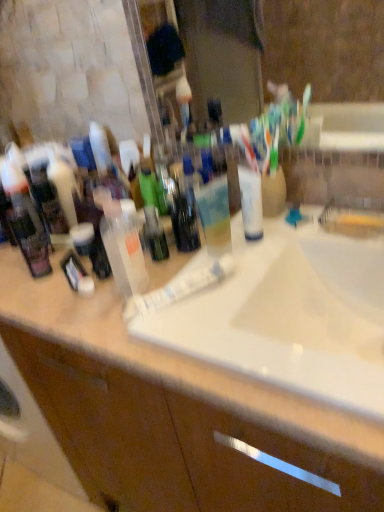
The image size is (384, 512). I want to click on vacant space in front of matte black lotion at center, arranged as the 1th toiletry when viewed from the left, so 36,281.